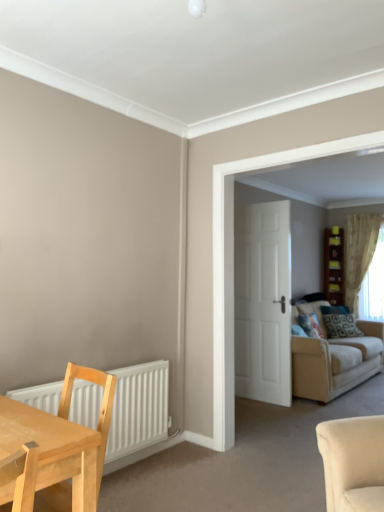
Describe the element at coordinates (53, 449) in the screenshot. I see `light wood table at lower left` at that location.

Describe the element at coordinates (138, 408) in the screenshot. The height and width of the screenshot is (512, 384). I see `white matte radiator at lower left` at that location.

What do you see at coordinates (341, 326) in the screenshot?
I see `patterned fabric pillow at center-right` at bounding box center [341, 326].

The width and height of the screenshot is (384, 512). Identify the location of beige fabric couch at right. (335, 362).

From the image's perspective, which is above, sheer beige curtain at right or white matte radiator at lower left?

From the image's view, sheer beige curtain at right is above.

The height and width of the screenshot is (512, 384). I want to click on radiator in front of the sheer beige curtain at right, so click(x=138, y=408).

Is sheer beige curtain at right not close to white matte radiator at lower left?

That's right, there is a large distance between sheer beige curtain at right and white matte radiator at lower left.

Is beige fabric couch at right positioned behind sheer beige curtain at right?

That is False.

Is point (299, 359) positioned before point (354, 287)?

Yes, point (299, 359) is closer to viewer.

Considering the relative sizes of beige fabric couch at right and sheer beige curtain at right in the image provided, is beige fabric couch at right smaller than sheer beige curtain at right?

No.

From the picture: Considering the sizes of objects white matte door at center and patterned fabric pillow at center-right in the image provided, who is shorter, white matte door at center or patterned fabric pillow at center-right?

Standing shorter between the two is patterned fabric pillow at center-right.

Is patterned fabric pillow at center-right a part of white matte door at center?

No.

Where is `door located above the patterned fabric pillow at center-right (from the image's perspective)`? This screenshot has width=384, height=512. door located above the patterned fabric pillow at center-right (from the image's perspective) is located at coordinates (263, 302).

Would you consider white matte door at center to be distant from patterned fabric pillow at center-right?

white matte door at center is far away from patterned fabric pillow at center-right.

Which of these two, brown wooden bookshelf at center-right or sheer beige curtain at right, is bigger?

sheer beige curtain at right.

Considering the relative sizes of brown wooden bookshelf at center-right and sheer beige curtain at right in the image provided, is brown wooden bookshelf at center-right shorter than sheer beige curtain at right?

Correct, brown wooden bookshelf at center-right is not as tall as sheer beige curtain at right.

Identify the location of curtain that appears in front of the brown wooden bookshelf at center-right. (359, 253).

Is point (351, 306) farther from viewer compared to point (340, 288)?

No, it is not.

From a real-world perspective, which object rests below the other?

sheer beige curtain at right.

Choose the correct answer: Is sheer beige curtain at right inside brown wooden bookshelf at center-right or outside it?

sheer beige curtain at right is not inside brown wooden bookshelf at center-right, it's outside.

This screenshot has width=384, height=512. What are the coordinates of `pillow that appears below the sheer beige curtain at right (from a real-world perspective)` in the screenshot? It's located at (341, 326).

From their relative heights in the image, would you say sheer beige curtain at right is taller or shorter than patterned fabric pillow at center-right?

In the image, sheer beige curtain at right appears to be taller than patterned fabric pillow at center-right.

Between sheer beige curtain at right and patterned fabric pillow at center-right, which one appears on the right side from the viewer's perspective?

Positioned to the right is sheer beige curtain at right.

From a real-world perspective, is sheer beige curtain at right below patterned fabric pillow at center-right?

No, from a real-world perspective, sheer beige curtain at right is not under patterned fabric pillow at center-right.

How different are the orientations of white matte door at center and white matte radiator at lower left in degrees?

white matte door at center and white matte radiator at lower left are facing 88.3 degrees away from each other.

From a real-world perspective, is white matte door at center physically above white matte radiator at lower left?

Correct, in the physical world, white matte door at center is higher than white matte radiator at lower left.

Is the depth of white matte door at center less than that of white matte radiator at lower left?

No, it is behind white matte radiator at lower left.

Where is `radiator lying below the sheer beige curtain at right (from the image's perspective)`? This screenshot has height=512, width=384. radiator lying below the sheer beige curtain at right (from the image's perspective) is located at coordinates (138, 408).

Where is `curtain that appears behind the beige fabric couch at right`? curtain that appears behind the beige fabric couch at right is located at coordinates (359, 253).

Which object lies nearer to the anchor point brown wooden bookshelf at center-right, white matte radiator at lower left or patterned fabric pillow at center-right?

patterned fabric pillow at center-right.

From the image, which object appears to be farther from white matte radiator at lower left, brown wooden bookshelf at center-right or light wood table at lower left?

brown wooden bookshelf at center-right is positioned further to the anchor white matte radiator at lower left.

Based on their spatial positions, is white matte door at center or light wood table at lower left closer to patterned fabric pillow at center-right?

Among the two, white matte door at center is located nearer to patterned fabric pillow at center-right.

From the image, which object appears to be nearer to brown wooden bookshelf at center-right, light wood table at lower left or beige fabric couch at right?

beige fabric couch at right.

Looking at the image, which one is located further to white matte radiator at lower left, beige fabric couch at right or light wood table at lower left?

beige fabric couch at right.

Considering their positions, is white matte radiator at lower left positioned further to white matte door at center than patterned fabric pillow at center-right?

Based on the image, patterned fabric pillow at center-right appears to be further to white matte door at center.

From the image, which object appears to be farther from light wood table at lower left, white matte door at center or beige fabric couch at right?

beige fabric couch at right lies further to light wood table at lower left than the other object.

From the image, which object appears to be farther from white matte door at center, patterned fabric pillow at center-right or white matte radiator at lower left?

patterned fabric pillow at center-right is further to white matte door at center.

Where is `door positioned between beige fabric couch at right and brown wooden bookshelf at center-right from near to far`? The width and height of the screenshot is (384, 512). door positioned between beige fabric couch at right and brown wooden bookshelf at center-right from near to far is located at coordinates (263, 302).

The height and width of the screenshot is (512, 384). In order to click on studio couch between light wood table at lower left and brown wooden bookshelf at center-right along the z-axis in this screenshot , I will do `click(335, 362)`.

I want to click on pillow located between light wood table at lower left and brown wooden bookshelf at center-right in the depth direction, so click(341, 326).

Identify the location of pillow between white matte radiator at lower left and brown wooden bookshelf at center-right in the front-back direction. (341, 326).